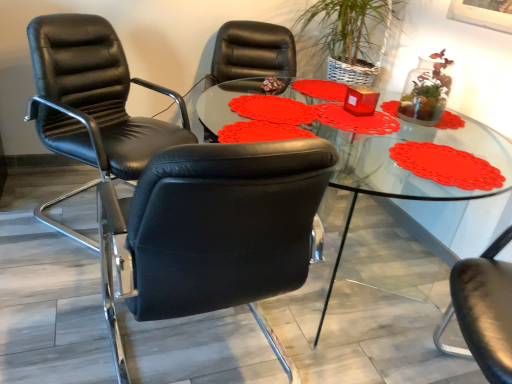
Measure the distance between transparent glass table at center and camera.

They are 1.40 meters apart.

In order to face black leather chair at left, the second chair viewed from the back, should I rotate leftwards or rightwards?

To align with it, rotate left about 6.467°.

At what (x,y) coordinates should I click in order to perform the action: click on transparent glass table at center. Please return your answer as a coordinate pair (x, y). Image resolution: width=512 pixels, height=384 pixels. Looking at the image, I should click on (376, 182).

Considering the positions of point (346, 173) and point (126, 261), is point (346, 173) closer or farther from the camera than point (126, 261)?

Clearly, point (346, 173) is more distant from the camera than point (126, 261).

Can we say transparent glass table at center lies outside black leather chair at left, marked as the first chair in a front-to-back arrangement?

Yes.

Is transparent glass table at center oriented away from black leather chair at left, the second chair viewed from the back?

transparent glass table at center does not have its back to black leather chair at left, the second chair viewed from the back.

At what (x,y) coordinates should I click in order to perform the action: click on table lying on the right of black leather chair at left, the second chair viewed from the back. Please return your answer as a coordinate pair (x, y). Looking at the image, I should click on (376, 182).

From a real-world perspective, between black leather chair at left, the second chair viewed from the back, and transparent glass table at center, who is vertically lower?

transparent glass table at center is physically lower.

Which is more to the left, black leather chair at left, the second chair viewed from the back, or transparent glass table at center?

Positioned to the left is black leather chair at left, the second chair viewed from the back.

Measure the distance from black leather chair at left, marked as the first chair in a front-to-back arrangement, to transparent glass table at center.

They are 30.51 inches apart.

Based on the photo, is there a large distance between black leather chair at left, the second chair viewed from the back, and black leather chair at left, the 1th chair when ordered from back to front?

No, there isn't a large distance between black leather chair at left, the second chair viewed from the back, and black leather chair at left, the 1th chair when ordered from back to front.

Could you tell me if black leather chair at left, the second chair viewed from the back, is facing black leather chair at left, which is the 2th chair from front to back?

Yes, black leather chair at left, the second chair viewed from the back, is oriented towards black leather chair at left, which is the 2th chair from front to back.

Looking at their sizes, would you say black leather chair at left, marked as the first chair in a front-to-back arrangement, is wider or thinner than black leather chair at left, which is the 2th chair from front to back?

Clearly, black leather chair at left, marked as the first chair in a front-to-back arrangement, has more width compared to black leather chair at left, which is the 2th chair from front to back.

The width and height of the screenshot is (512, 384). Identify the location of chair behind the black leather chair at left, the second chair viewed from the back. (93, 98).

Is point (333, 275) positioned in front of point (36, 98)?

No, it is not.

From the picture: Which of these two, transparent glass table at center or black leather chair at left, the 1th chair when ordered from back to front, is smaller?

black leather chair at left, the 1th chair when ordered from back to front, is smaller.

Is transparent glass table at center at the left side of black leather chair at left, which is the 2th chair from front to back?

Incorrect, transparent glass table at center is not on the left side of black leather chair at left, which is the 2th chair from front to back.

Is transparent glass table at center situated inside black leather chair at left, which is the 2th chair from front to back, or outside?

The correct answer is: outside.

Is black leather chair at left, which is the 2th chair from front to back, with transparent glass table at center?

black leather chair at left, which is the 2th chair from front to back, is not next to transparent glass table at center, and they're not touching.

Considering the sizes of objects black leather chair at left, the 1th chair when ordered from back to front, and transparent glass table at center in the image provided, who is bigger, black leather chair at left, the 1th chair when ordered from back to front, or transparent glass table at center?

Bigger between the two is transparent glass table at center.

Is black leather chair at left, which is the 2th chair from front to back, further to the viewer compared to transparent glass table at center?

Yes, the depth of black leather chair at left, which is the 2th chair from front to back, is greater than that of transparent glass table at center.

Which of these two, black leather chair at left, which is the 2th chair from front to back, or transparent glass table at center, is wider?

transparent glass table at center is wider.

From a real-world perspective, is black leather chair at left, which is the 2th chair from front to back, on top of black leather chair at left, the second chair viewed from the back?

Correct, in the physical world, black leather chair at left, which is the 2th chair from front to back, is higher than black leather chair at left, the second chair viewed from the back.

How many degrees apart are the facing directions of black leather chair at left, the 1th chair when ordered from back to front, and black leather chair at left, marked as the first chair in a front-to-back arrangement?

black leather chair at left, the 1th chair when ordered from back to front, and black leather chair at left, marked as the first chair in a front-to-back arrangement, are facing 142 degrees away from each other.

Is point (74, 17) positioned before point (176, 206)?

No, it is behind (176, 206).

Is black leather chair at left, which is the 2th chair from front to back, directly adjacent to black leather chair at left, marked as the first chair in a front-to-back arrangement?

No, black leather chair at left, which is the 2th chair from front to back, is not touching black leather chair at left, marked as the first chair in a front-to-back arrangement.

You are a GUI agent. You are given a task and a screenshot of the screen. Output one action in this format:
    pyautogui.click(x=<x>, y=<y>)
    Task: Click on the chair below the transparent glass table at center (from the image's perspective)
    The width and height of the screenshot is (512, 384).
    Given the screenshot: What is the action you would take?
    pyautogui.click(x=223, y=228)

The image size is (512, 384). I want to click on chair that is the 1st one above the transparent glass table at center (from a real-world perspective), so click(x=223, y=228).

Estimate the real-world distances between objects in this image. Which object is closer to black leather chair at left, which is the 2th chair from front to back, transparent glass table at center or black leather chair at left, marked as the first chair in a front-to-back arrangement?

transparent glass table at center is positioned closer to the anchor black leather chair at left, which is the 2th chair from front to back.

Considering their positions, is black leather chair at left, the second chair viewed from the back, positioned further to black leather chair at left, which is the 2th chair from front to back, than transparent glass table at center?

black leather chair at left, the second chair viewed from the back, is further to black leather chair at left, which is the 2th chair from front to back.

When comparing their distances from black leather chair at left, marked as the first chair in a front-to-back arrangement, does transparent glass table at center or black leather chair at left, the 1th chair when ordered from back to front, seem further?

The object further to black leather chair at left, marked as the first chair in a front-to-back arrangement, is black leather chair at left, the 1th chair when ordered from back to front.

Estimate the real-world distances between objects in this image. Which object is further from transparent glass table at center, black leather chair at left, the second chair viewed from the back, or black leather chair at left, the 1th chair when ordered from back to front?

The object further to transparent glass table at center is black leather chair at left, the 1th chair when ordered from back to front.

From the image, which object appears to be farther from black leather chair at left, marked as the first chair in a front-to-back arrangement, black leather chair at left, which is the 2th chair from front to back, or transparent glass table at center?

black leather chair at left, which is the 2th chair from front to back, is positioned further to the anchor black leather chair at left, marked as the first chair in a front-to-back arrangement.

Looking at the image, which one is located further to transparent glass table at center, black leather chair at left, which is the 2th chair from front to back, or black leather chair at left, the second chair viewed from the back?

black leather chair at left, which is the 2th chair from front to back, is positioned further to the anchor transparent glass table at center.

Identify the location of chair located between black leather chair at left, which is the 2th chair from front to back, and transparent glass table at center in the left-right direction. (223, 228).